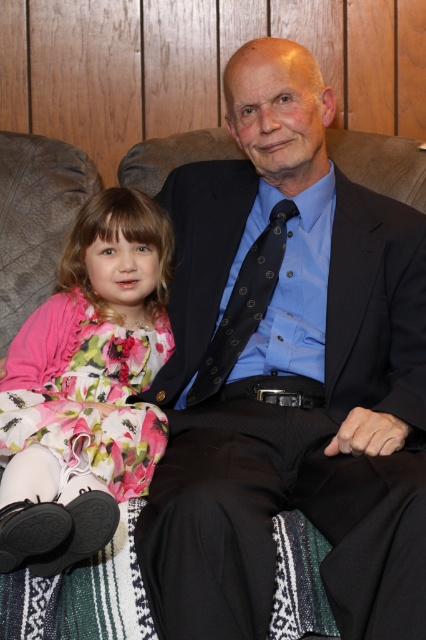
Question: Which point is closer to the camera taking this photo?

Choices:
 (A) (319, 304)
 (B) (77, 336)

Answer: (A)

Question: Can you confirm if matte black suit at center is positioned above floral fabric dress at left?

Choices:
 (A) yes
 (B) no

Answer: (A)

Question: Does matte black suit at center have a smaller size compared to floral fabric dress at left?

Choices:
 (A) yes
 (B) no

Answer: (B)

Question: Which of the following is the closest to the observer?

Choices:
 (A) (245, 307)
 (B) (164, 584)

Answer: (B)

Question: Which point appears closest to the camera in this image?

Choices:
 (A) (256, 269)
 (B) (380, 355)
 (C) (147, 248)

Answer: (B)

Question: Observing the image, what is the correct spatial positioning of matte black suit at center in reference to black textured tie at center?

Choices:
 (A) below
 (B) above

Answer: (A)